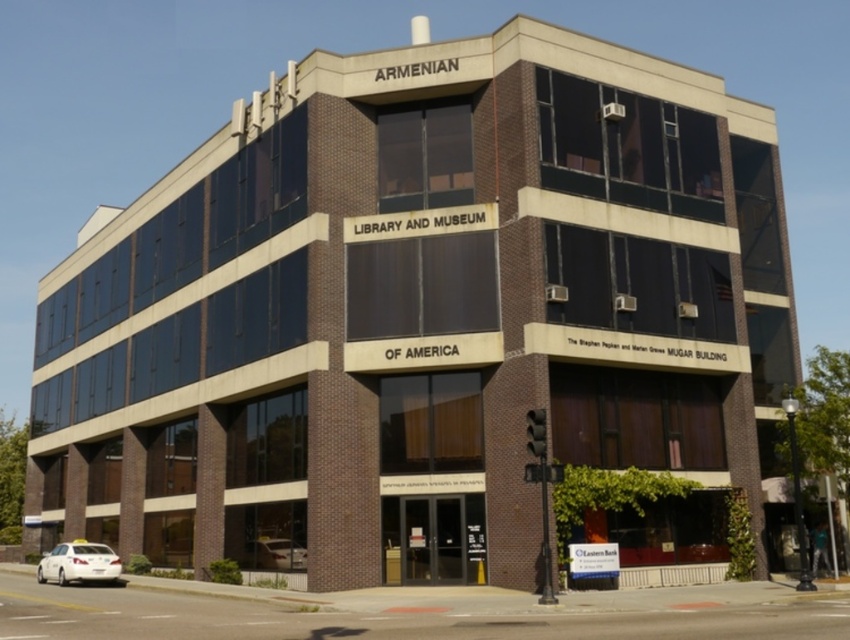
Can you confirm if white matte taxi cab at lower left is bigger than white glossy car at lower center?

Indeed, white matte taxi cab at lower left has a larger size compared to white glossy car at lower center.

Is point (105, 570) positioned behind point (287, 554)?

Yes, it is behind point (287, 554).

Which is behind, point (97, 557) or point (303, 563)?

The point (97, 557) is more distant.

Identify the location of white matte taxi cab at lower left. (78, 563).